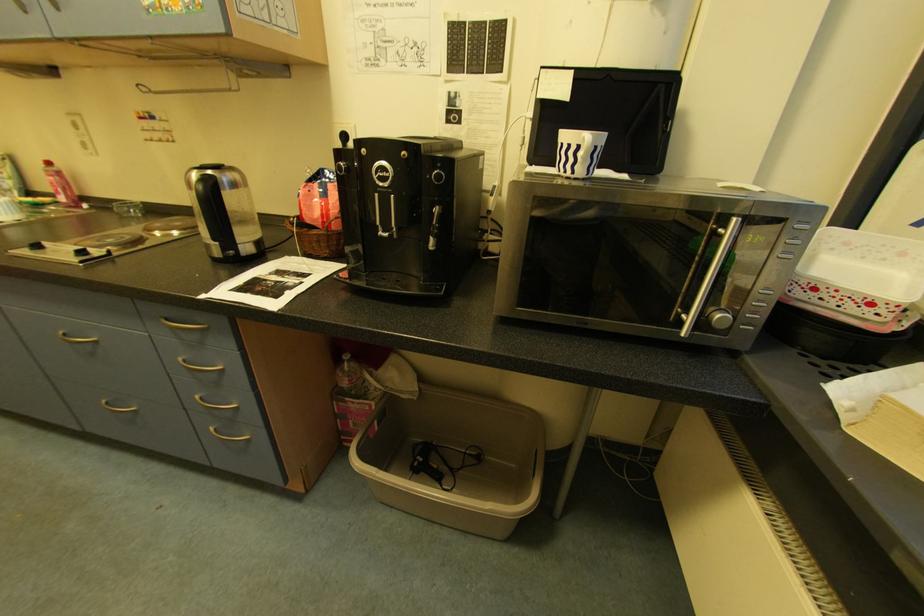
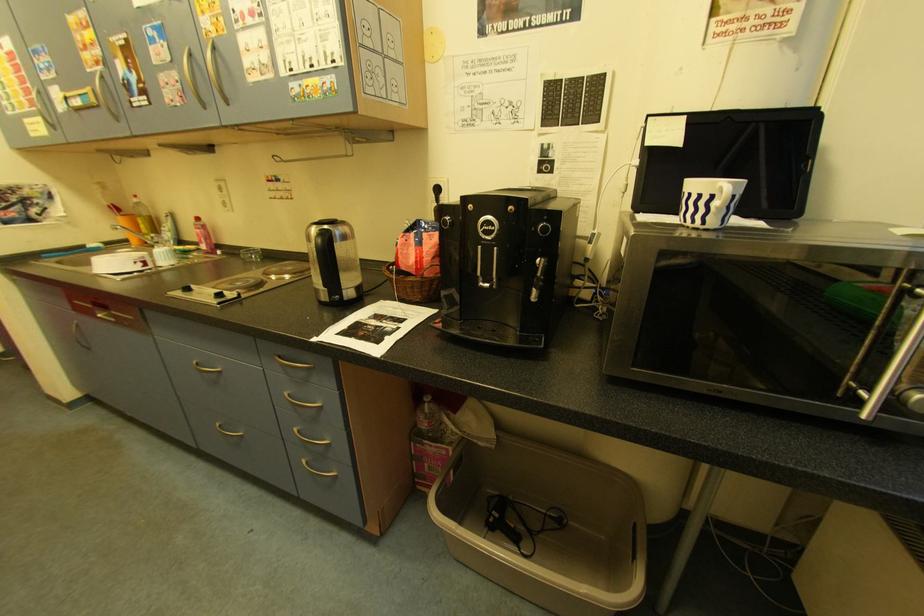
Question: Which direction would the cameraman need to move to produce the second image? Reply with the corresponding letter.

Choices:
 (A) Left
 (B) Right
 (C) Forward
 (D) Backward

Answer: (A)